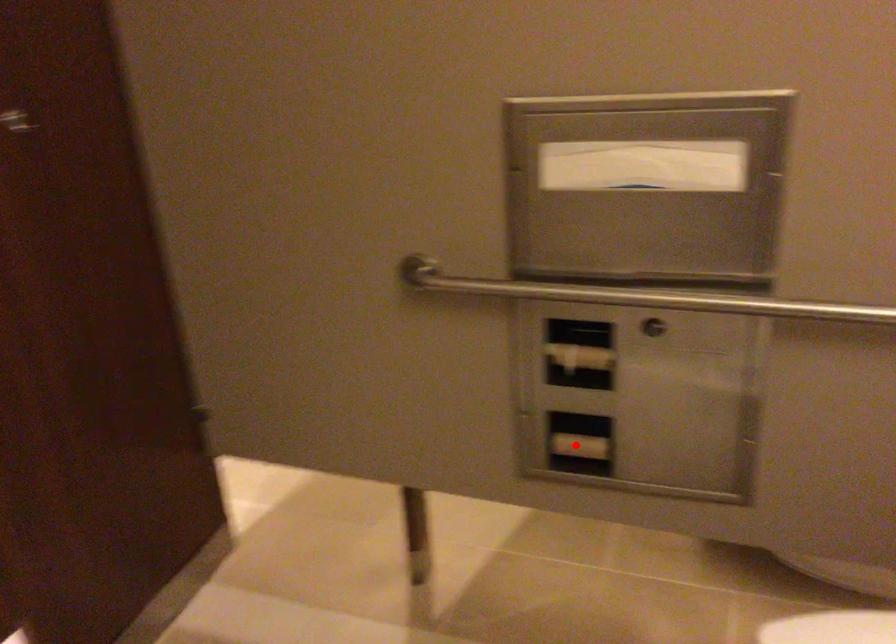
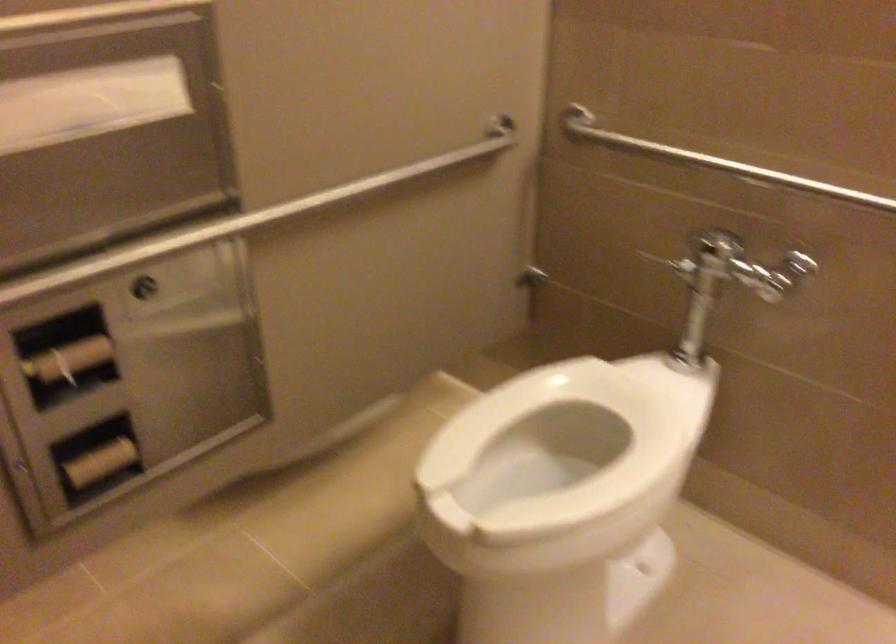
Question: I am providing you with two images of the same scene from different viewpoints. Image1 has a red point marked. In image2, the corresponding 3D location appears at what relative position? Reply with the corresponding letter.

Choices:
 (A) Closer
 (B) Farther

Answer: (A)